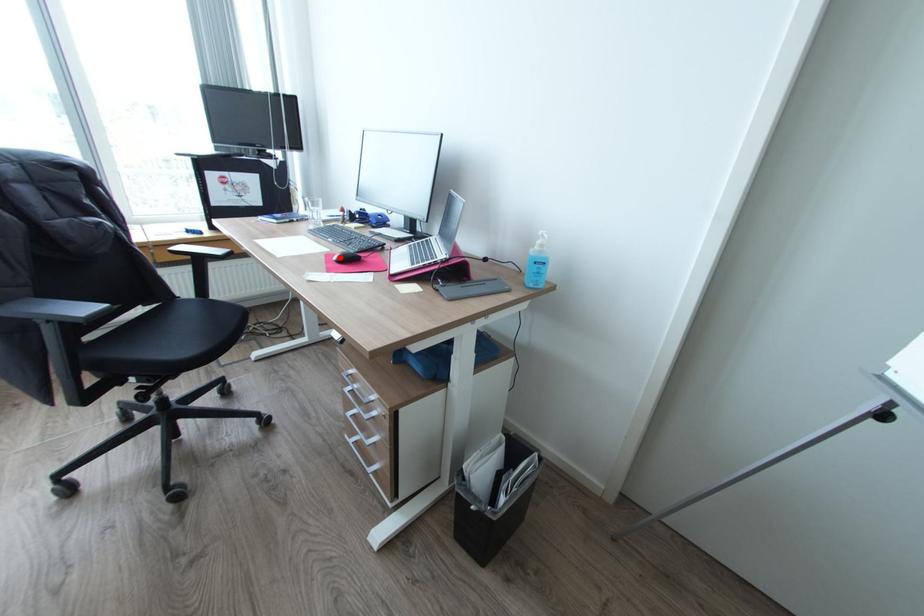
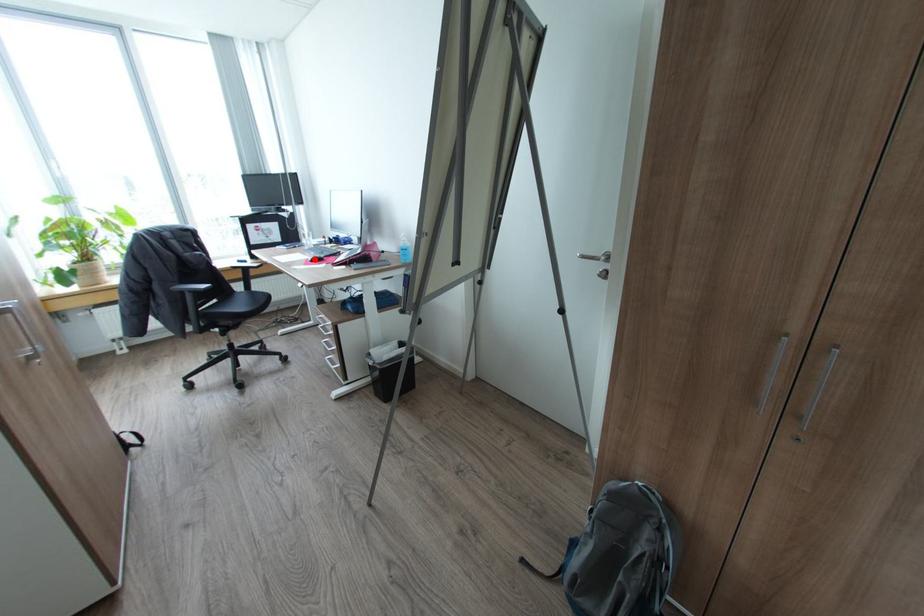
I am providing you with two images of the same scene from different viewpoints. A red point is marked on the first image and another point is marked on the second image. Do the highlighted points in image1 and image2 indicate the same real-world spot?

Yes